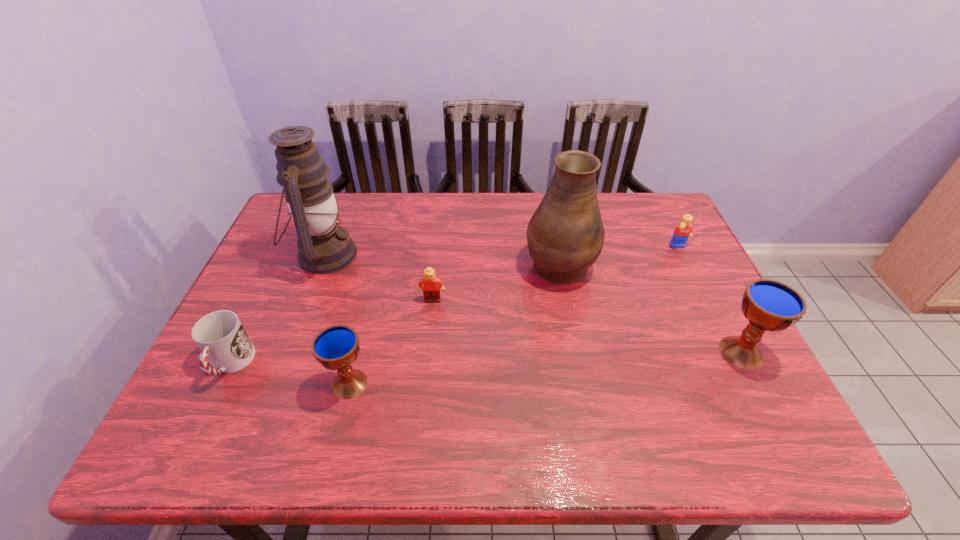
This screenshot has width=960, height=540. Identify the location of the farther Lego. (683, 231).

The height and width of the screenshot is (540, 960). I want to click on vacant space located on the right of the fourth shortest object, so click(x=461, y=384).

This screenshot has height=540, width=960. Identify the location of vacant space located 0.060m on the left of the third tallest object. (690, 352).

You are a GUI agent. You are given a task and a screenshot of the screen. Output one action in this format:
    pyautogui.click(x=<x>, y=<y>)
    Task: Click on the free space located 0.380m on the right of the oil lamp
    Image resolution: width=960 pixels, height=540 pixels.
    Given the screenshot: What is the action you would take?
    pyautogui.click(x=486, y=255)

Locate an element on the screen. This screenshot has height=540, width=960. vacant area situated 0.230m on the face of the fourth nearest object is located at coordinates (424, 379).

I want to click on free space located on the handle side of the third object from right to left, so click(546, 194).

Locate an element on the screen. vacant space located on the handle side of the third object from right to left is located at coordinates (545, 192).

The image size is (960, 540). I want to click on vacant space located on the handle side of the third object from right to left, so click(546, 197).

I want to click on vacant space located 0.400m on the face of the farther Lego, so click(738, 366).

You are a GUI agent. You are given a task and a screenshot of the screen. Output one action in this format:
    pyautogui.click(x=<x>, y=<y>)
    Task: Click on the object located in the far edge section of the desktop
    
    Given the screenshot: What is the action you would take?
    coord(324,247)